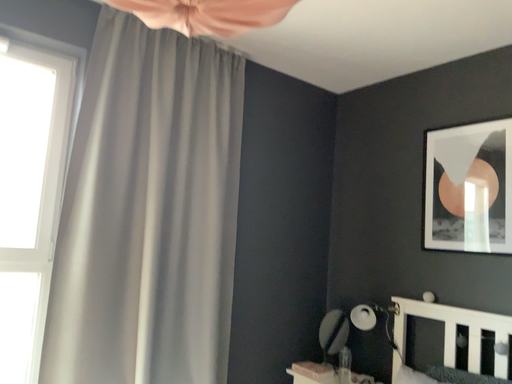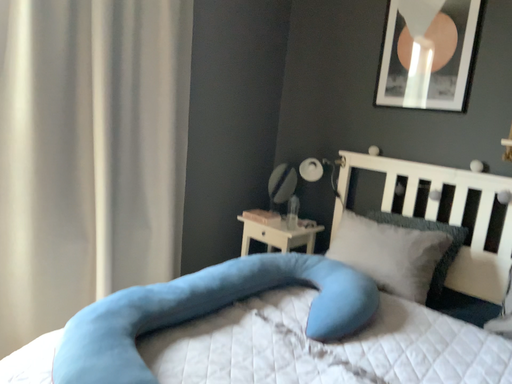
Question: How did the camera likely rotate when shooting the video?

Choices:
 (A) rotated left
 (B) rotated right

Answer: (B)